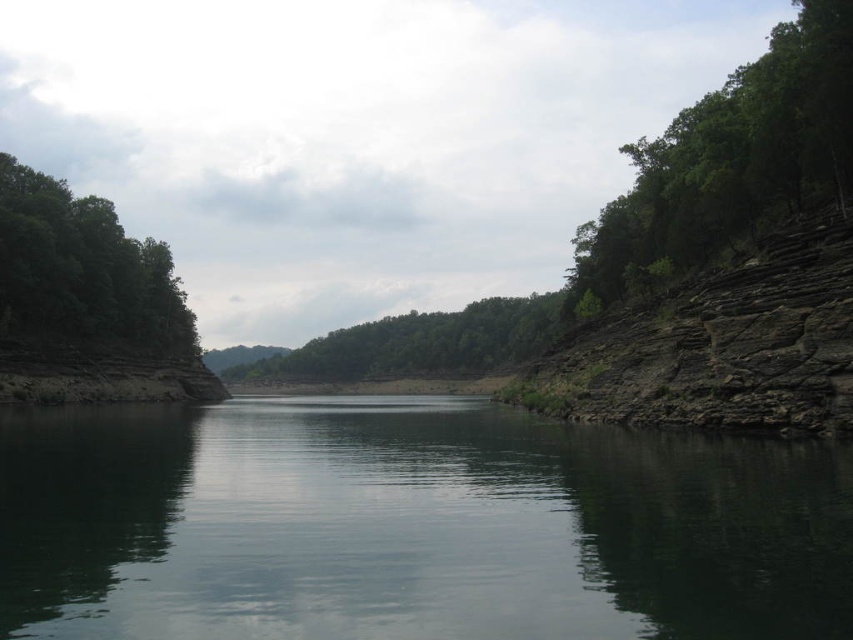
Can you confirm if green leafy tree at left is taller than green leafy trees at center?

No, green leafy tree at left is not taller than green leafy trees at center.

From the picture: Between green leafy tree at left and green leafy trees at center, which one appears on the right side from the viewer's perspective?

Positioned to the right is green leafy trees at center.

What do you see at coordinates (83, 273) in the screenshot? This screenshot has height=640, width=853. I see `green leafy tree at left` at bounding box center [83, 273].

This screenshot has width=853, height=640. What are the coordinates of `green leafy tree at left` in the screenshot? It's located at (83, 273).

Is point (297, 605) closer to camera compared to point (666, 128)?

Yes.

Between point (70, 493) and point (689, 129), which one is positioned behind?

The point (689, 129) is behind.

The image size is (853, 640). What are the coordinates of `dark green water at center` in the screenshot? It's located at (412, 525).

Is point (175, 432) closer to camera compared to point (225, 371)?

Yes.

Is point (753, 570) positioned before point (271, 369)?

Yes, it is in front of point (271, 369).

Image resolution: width=853 pixels, height=640 pixels. In order to click on dark green water at center in this screenshot , I will do `click(412, 525)`.